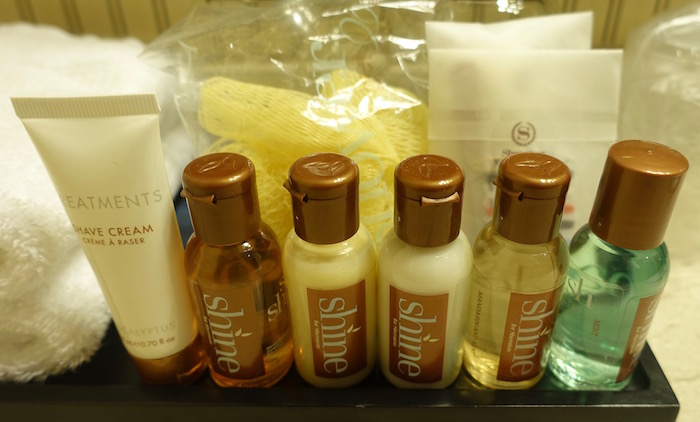
The height and width of the screenshot is (422, 700). Identify the location of tray. (x=188, y=405).